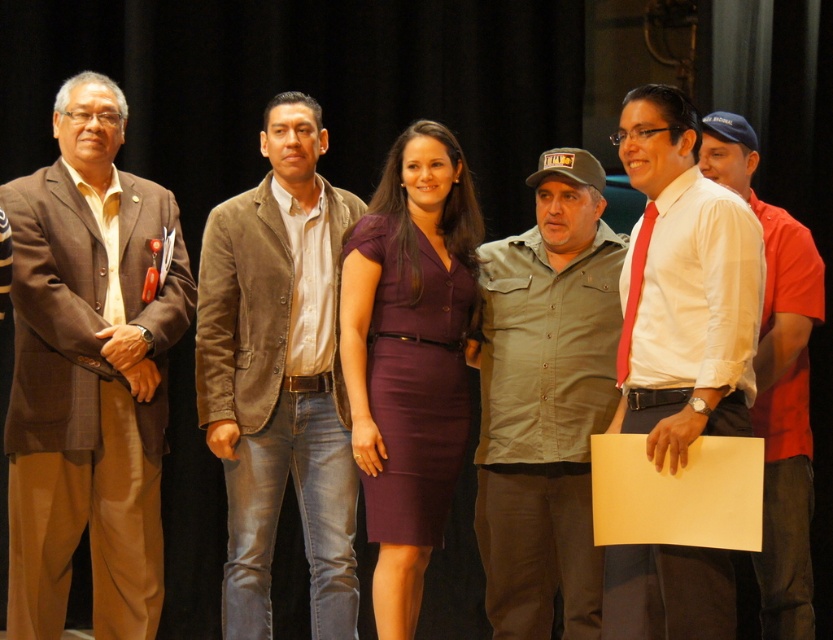
Can you confirm if brown textured suit at left is positioned below white smooth shirt at center?

Yes, brown textured suit at left is below white smooth shirt at center.

Who is more distant from viewer, (x=78, y=465) or (x=677, y=232)?

Positioned behind is point (x=78, y=465).

Which is in front, point (85, 97) or point (711, 564)?

Point (711, 564) is more forward.

Identify the location of brown textured suit at left. (88, 372).

Can you confirm if suede jacket at center is shorter than white smooth shirt at center?

No, suede jacket at center is not shorter than white smooth shirt at center.

The image size is (833, 640). Describe the element at coordinates (278, 374) in the screenshot. I see `suede jacket at center` at that location.

Where is `suede jacket at center`? The image size is (833, 640). suede jacket at center is located at coordinates (278, 374).

Is brown textured suit at left taller than purple matte dress at center?

Indeed, brown textured suit at left has a greater height compared to purple matte dress at center.

What do you see at coordinates (88, 372) in the screenshot? I see `brown textured suit at left` at bounding box center [88, 372].

The height and width of the screenshot is (640, 833). I want to click on brown textured suit at left, so click(x=88, y=372).